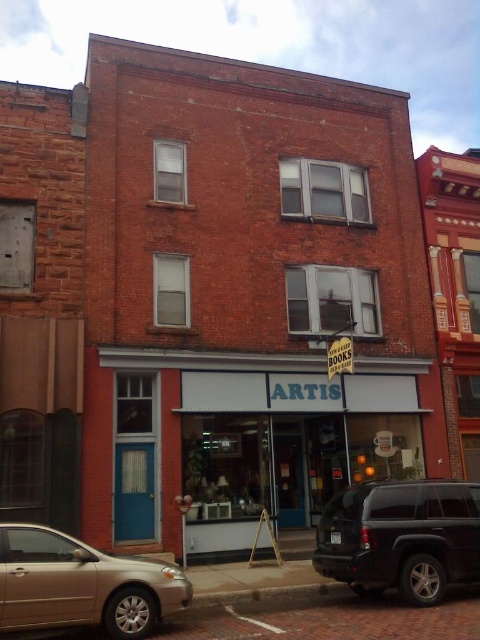
Question: Observing the image, what is the correct spatial positioning of shiny black suv at center in reference to gold metallic sedan at lower left?

Choices:
 (A) below
 (B) above

Answer: (B)

Question: Which of the following is the farthest from the observer?

Choices:
 (A) shiny black suv at center
 (B) gold metallic sedan at lower left

Answer: (A)

Question: Can you confirm if shiny black suv at center is positioned to the left of gold metallic sedan at lower left?

Choices:
 (A) yes
 (B) no

Answer: (B)

Question: Does shiny black suv at center have a smaller size compared to gold metallic sedan at lower left?

Choices:
 (A) yes
 (B) no

Answer: (B)